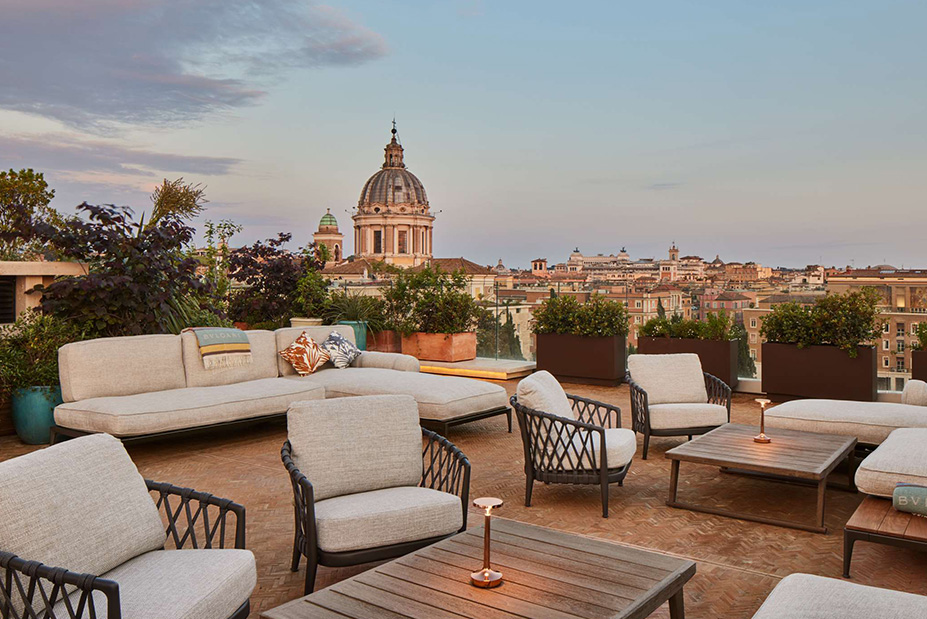
Locate an element on the screen. This screenshot has height=619, width=927. sectional is located at coordinates point(269,392).